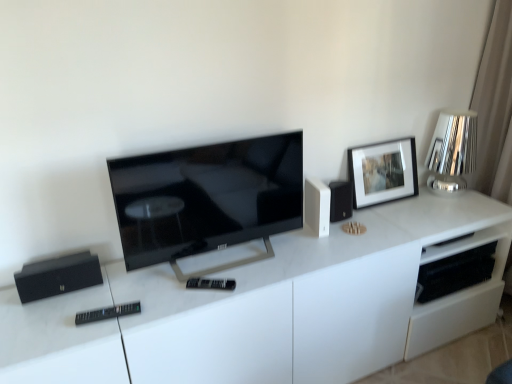
What are the coordinates of `free point below shiny metallic lamp at upper right (from a real-world perspective)` in the screenshot? It's located at (442, 197).